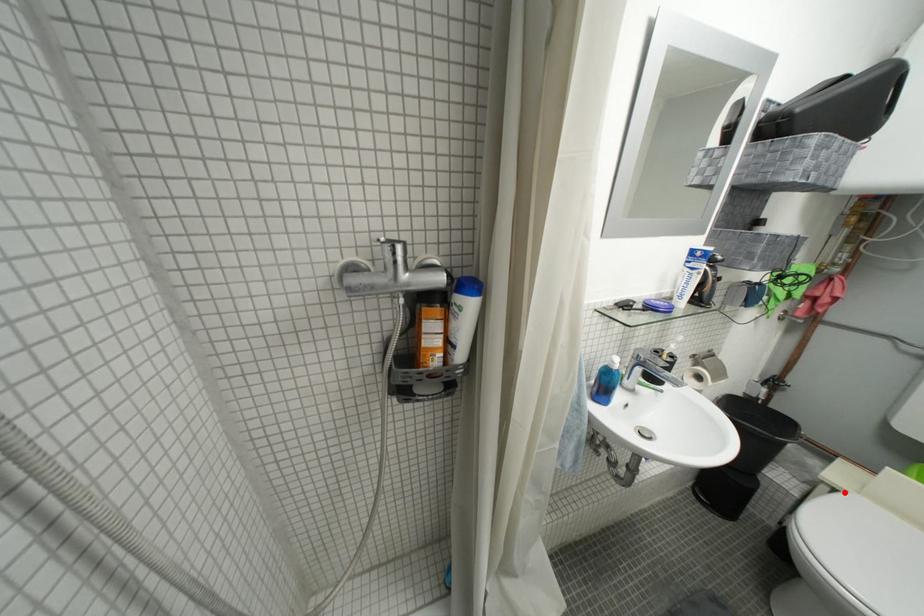
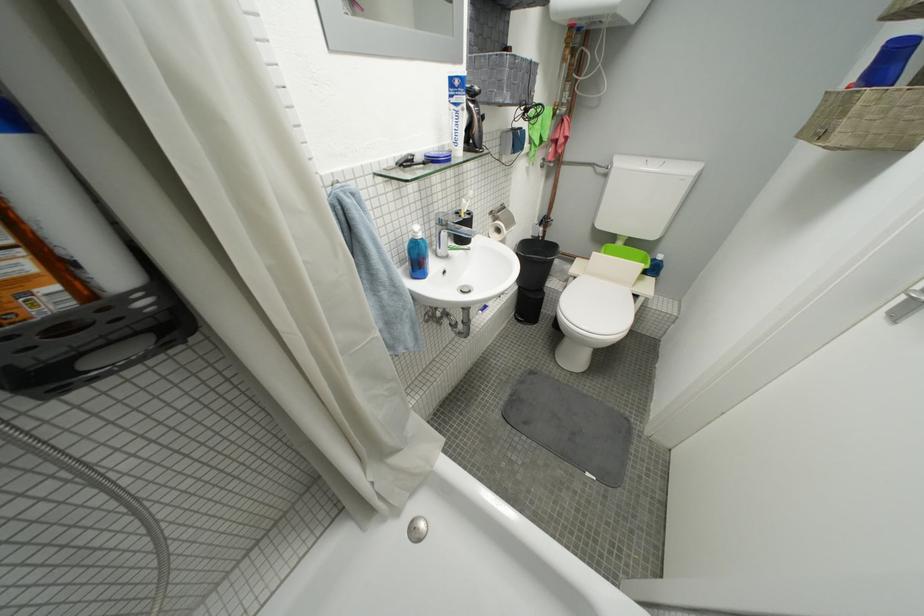
Locate, in the second image, the point that corresponds to the highlighted location in the first image.

(584, 281)